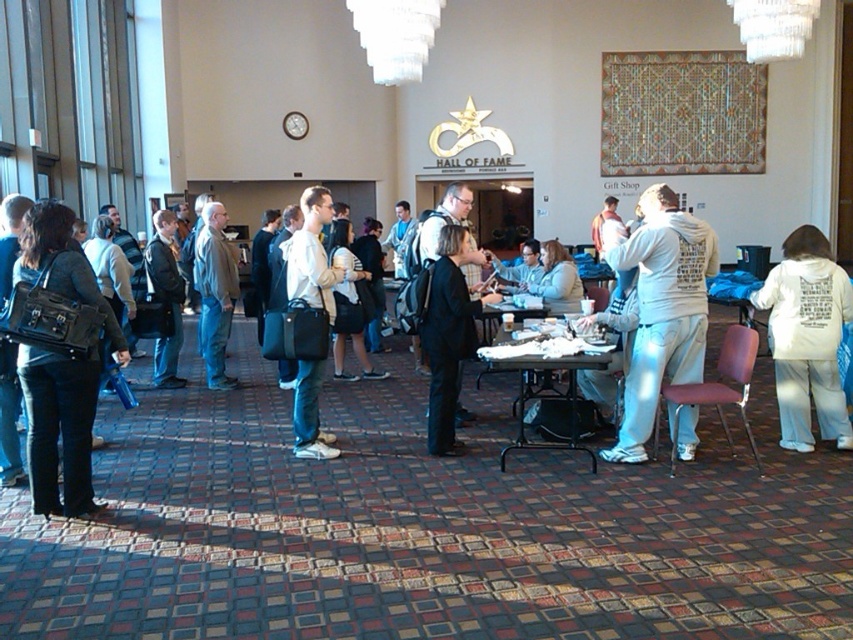
Question: Is black leather jacket at center to the left of light gray jacket at center from the viewer's perspective?

Choices:
 (A) no
 (B) yes

Answer: (A)

Question: Which of the following is the farthest from the observer?

Choices:
 (A) (506, 445)
 (B) (810, 280)
 (C) (164, 250)
 (D) (32, 387)

Answer: (C)

Question: Estimate the real-world distances between objects in this image. Which object is closer to the white matte jacket at center?

Choices:
 (A) wooden table at center
 (B) white cotton hoodie at right

Answer: (A)

Question: Does white cotton hoodie at right have a larger size compared to black leather jacket at center?

Choices:
 (A) yes
 (B) no

Answer: (A)

Question: Which point is closer to the camera?

Choices:
 (A) (437, 422)
 (B) (668, 204)
 (C) (218, 296)
 (D) (300, 200)

Answer: (B)

Question: Is matte black bag at left closer to camera compared to wooden table at center?

Choices:
 (A) yes
 (B) no

Answer: (A)